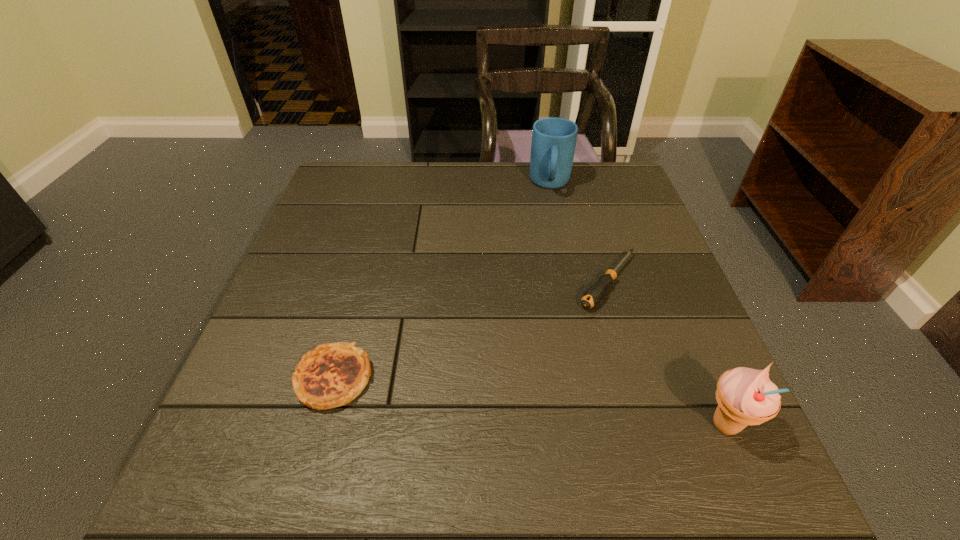
Locate an element on the screen. This screenshot has height=540, width=960. vacant space on the desktop that is between the leftmost object and the icecream and is positioned at the tip of the third nearest object is located at coordinates (509, 399).

Locate an element on the screen. vacant space on the desktop that is between the quiche and the icecream and is positioned on the side of the mug with the handle is located at coordinates (552, 404).